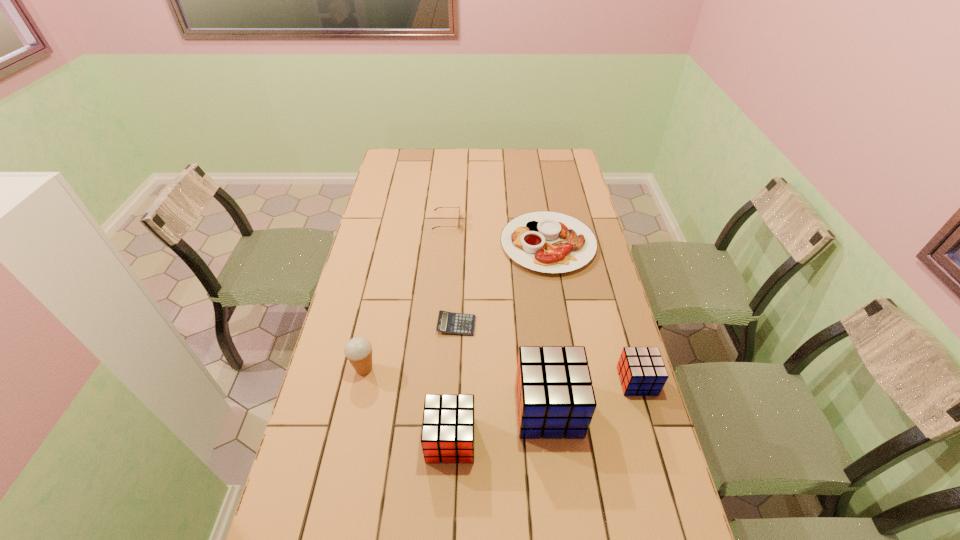
At what (x,y) coordinates should I click in order to perform the action: click on vacant space located 0.250m on the right of the leftmost cube. Please return your answer as a coordinate pair (x, y). Looking at the image, I should click on (569, 440).

The image size is (960, 540). Find the location of `vacant space situated 0.170m on the front of the second cube from left to right`. vacant space situated 0.170m on the front of the second cube from left to right is located at coordinates (561, 509).

Where is `free space located 0.340m on the left of the shortest cube`? free space located 0.340m on the left of the shortest cube is located at coordinates (503, 381).

Where is `vacant point located on the back of the icecream`? This screenshot has height=540, width=960. vacant point located on the back of the icecream is located at coordinates (374, 322).

I want to click on vacant space located 0.070m on the lenses of the sunglasses, so [x=478, y=222].

The image size is (960, 540). I want to click on free space located on the right of the shortest object, so click(543, 325).

This screenshot has width=960, height=540. I want to click on free space located 0.300m on the front of the sixth tallest object, so click(x=565, y=346).

Identify the location of object situated at the left edge. Image resolution: width=960 pixels, height=540 pixels. (358, 350).

Identify the location of cube at the right edge. This screenshot has width=960, height=540. (642, 372).

Locate an element on the screen. platter present at the right edge is located at coordinates (544, 241).